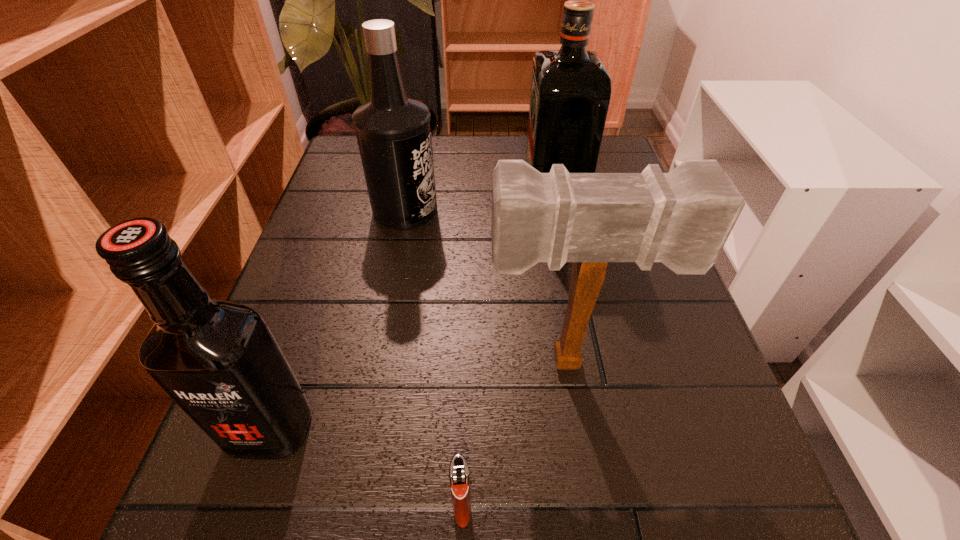
The width and height of the screenshot is (960, 540). Identify the location of blank area located on the front label of the second liquor from right to left. (475, 210).

At what (x,y) coordinates should I click in order to perform the action: click on blank space located 0.070m on the front-facing side of the nearest liquor. Please return your answer as a coordinate pair (x, y). Looking at the image, I should click on (239, 521).

Locate an element on the screen. vacant space located on the front of the mallet is located at coordinates (590, 485).

Locate an element on the screen. blank space located 0.100m on the back of the igniter is located at coordinates (465, 417).

You are a GUI agent. You are given a task and a screenshot of the screen. Output one action in this format:
    pyautogui.click(x=<x>, y=<y>)
    Task: Click on the object situated at the far edge
    This screenshot has height=540, width=960.
    Given the screenshot: What is the action you would take?
    pyautogui.click(x=570, y=93)

Where is `object at the near edge`? object at the near edge is located at coordinates (459, 478).

Locate an element on the screen. liquor at the right edge is located at coordinates (570, 93).

Locate an element on the screen. mallet present at the right edge is located at coordinates (683, 218).

At what (x,y) coordinates should I click in order to perform the action: click on object situated at the far right corner. Please return your answer as a coordinate pair (x, y). The image size is (960, 540). Looking at the image, I should click on tap(570, 93).

You are a GUI agent. You are given a task and a screenshot of the screen. Output one action in this format:
    pyautogui.click(x=<x>, y=<y>)
    Task: Click on the vacant space at the left edge of the desktop
    This screenshot has height=540, width=960.
    Given the screenshot: What is the action you would take?
    pyautogui.click(x=332, y=193)